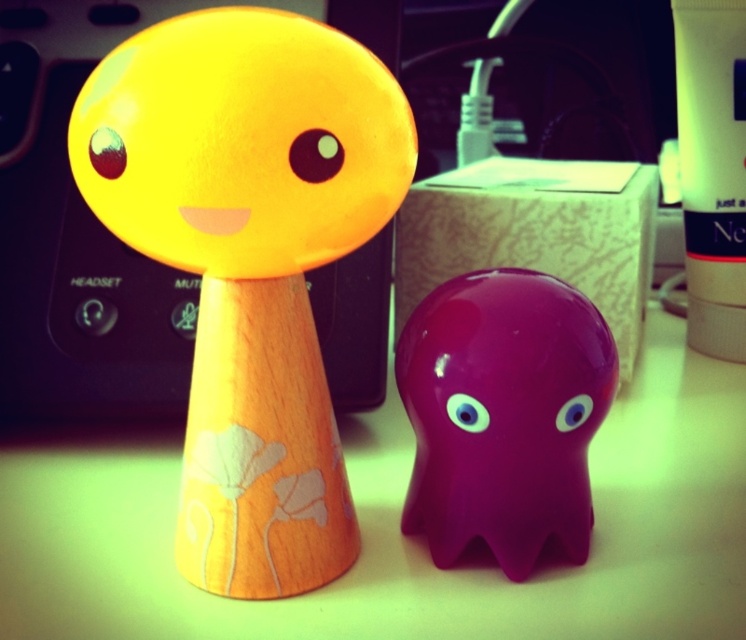
You are organizing a shelf and need to place the wooden yellow figurine at center and the glossy plastic ghost at center in a row from left to right. According to their positions in the image, which order should they be arranged in?

The wooden yellow figurine at center should be placed to the left of the glossy plastic ghost at center since it is already positioned to the left in the image.

You are a person with a 20 cm long ruler. You want to measure the distance between your eyes and the matte black eye at upper center. Can you do it accurately with your ruler?

The matte black eye at upper center and viewer are 21.24 inches apart. Since 21.24 inches is approximately 54 cm, and your ruler is only 20 cm long, you cannot measure the full distance accurately with your ruler.

What is located at the coordinates point [316,156] in the image?

The point [316,156] is where the matte black eye at upper center is located.